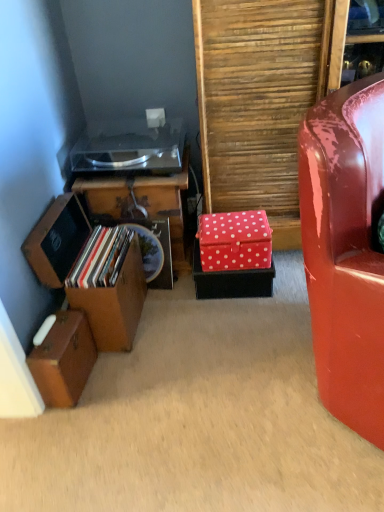
I want to click on empty space that is ontop of wooden storage box at left, the second storage box in the left-to-right sequence (from a real-world perspective), so click(99, 251).